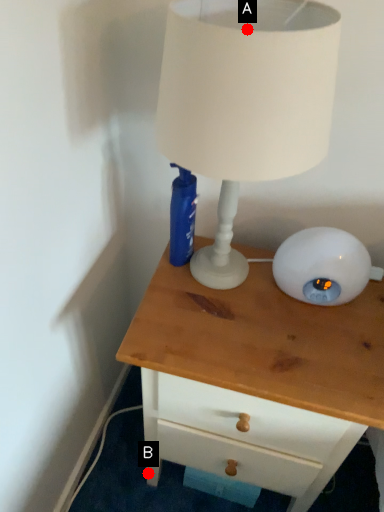
Question: Two points are circled on the image, labeled by A and B beside each circle. Which point is closer to the camera?

Choices:
 (A) A is closer
 (B) B is closer

Answer: (A)